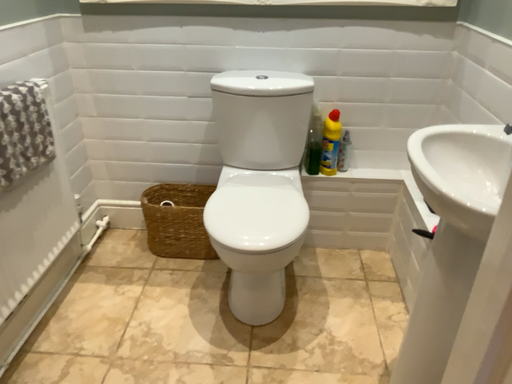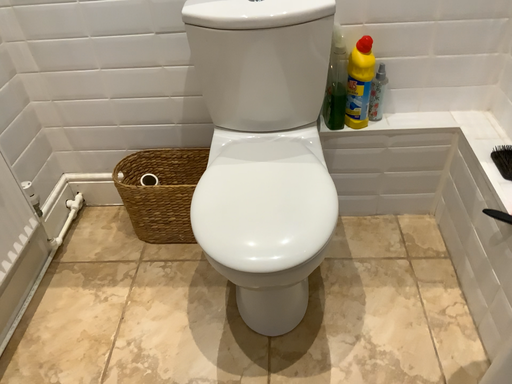
Question: How did the camera likely rotate when shooting the video?

Choices:
 (A) rotated upward
 (B) rotated downward

Answer: (B)